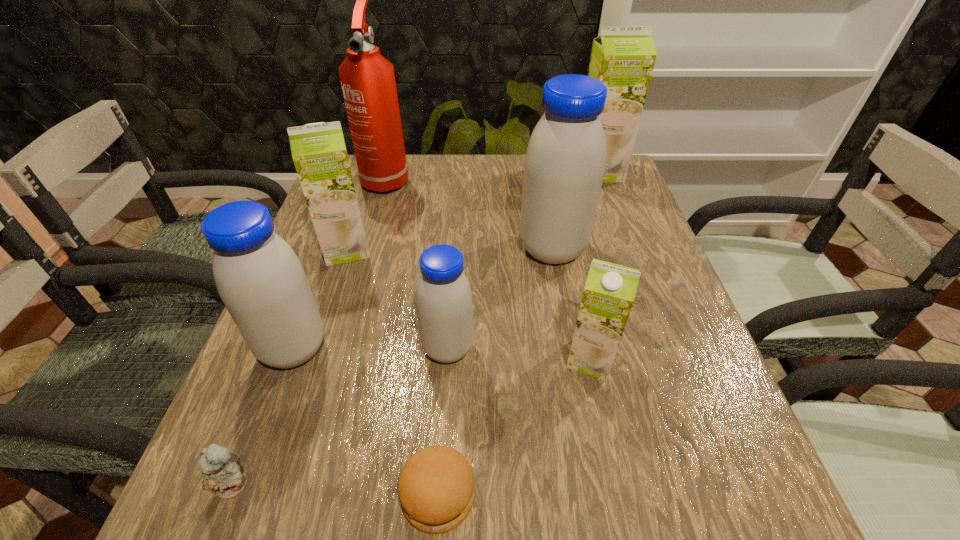
Locate which soya milk is the second closest to the rightmost green soya milk. Please provide its 2D coordinates. Your answer should be formatted as a tuple, i.e. [(x, y)], where the tuple contains the x and y coordinates of a point satisfying the conditions above.

[(609, 292)]

At what (x,y) coordinates should I click in order to perform the action: click on green soya milk identified as the third closest to the smallest blue soya milk. Please return your answer as a coordinate pair (x, y). Looking at the image, I should click on (622, 58).

Locate an element on the screen. green soya milk that stands as the second closest to the leftmost blue soya milk is located at coordinates pos(609,292).

Select which blue soya milk appears as the second closest to the rightmost blue soya milk. Please provide its 2D coordinates. Your answer should be formatted as a tuple, i.e. [(x, y)], where the tuple contains the x and y coordinates of a point satisfying the conditions above.

[(259, 278)]

Locate which blue soya milk ranks in proximity to the teddy bear. Please provide its 2D coordinates. Your answer should be formatted as a tuple, i.e. [(x, y)], where the tuple contains the x and y coordinates of a point satisfying the conditions above.

[(259, 278)]

You are a GUI agent. You are given a task and a screenshot of the screen. Output one action in this format:
    pyautogui.click(x=<x>, y=<y>)
    Task: Click on the free location that satisfies the following two spatial constraints: 1. at the nozzle of the fire extinguisher; 2. on the left side of the nearest green soya milk
    This screenshot has width=960, height=540.
    Given the screenshot: What is the action you would take?
    pyautogui.click(x=334, y=359)

Locate an element on the screen. The width and height of the screenshot is (960, 540). blank space that satisfies the following two spatial constraints: 1. on the front-facing side of the second shortest object; 2. on the right side of the brown hamburger is located at coordinates click(230, 496).